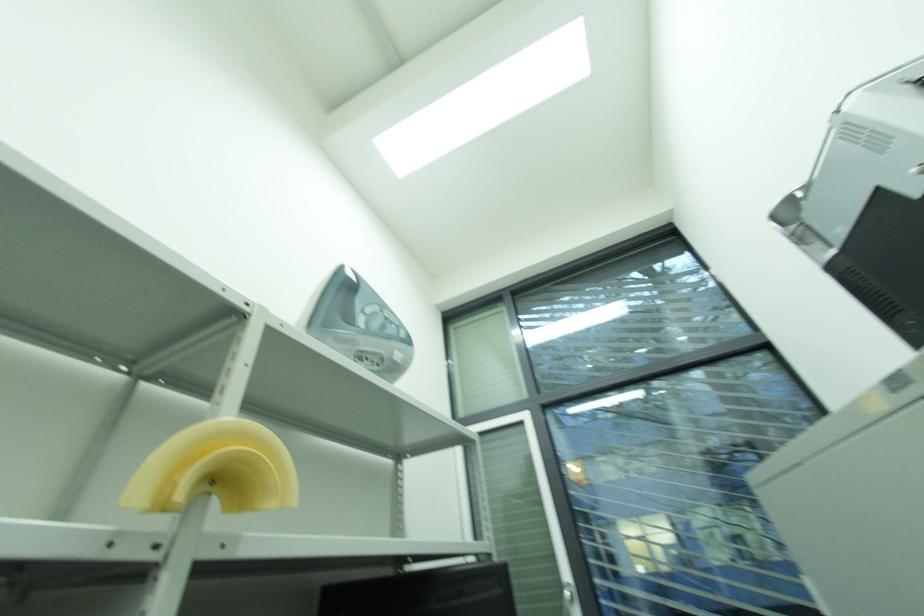
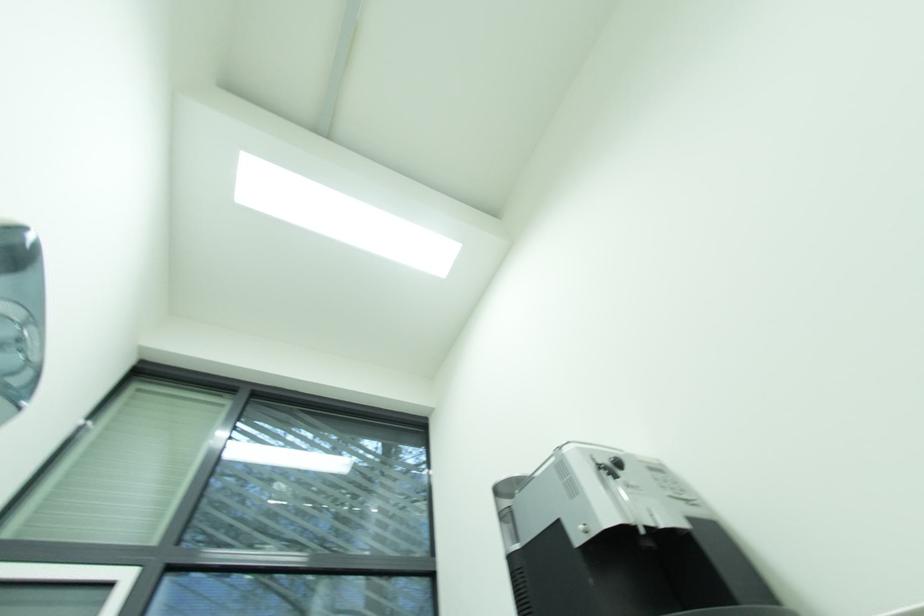
How did the camera likely rotate?

The camera rotated toward right-up.